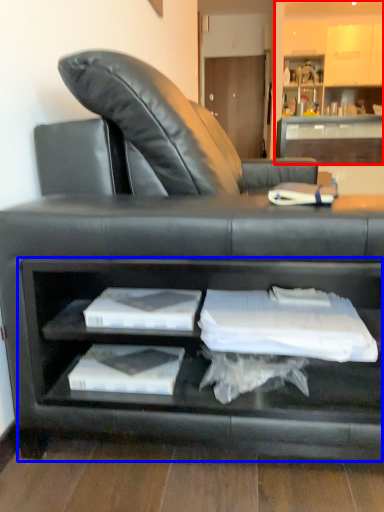
Question: Among these objects, which one is nearest to the camera, entertainment center (highlighted by a red box) or cabinet (highlighted by a blue box)?

Choices:
 (A) entertainment center
 (B) cabinet

Answer: (B)